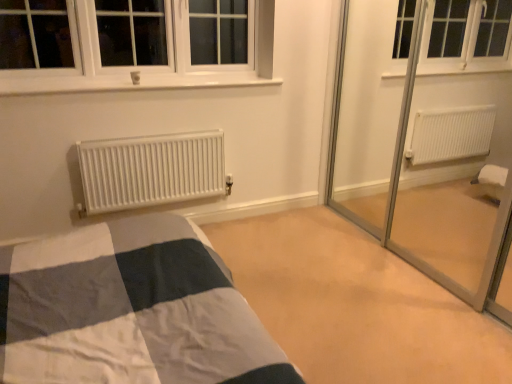
Locate an element on the screen. The image size is (512, 384). beige carpet at center is located at coordinates (356, 304).

Consider the image. Measure the distance between point [328,369] and camera.

They are 5.88 feet apart.

What do you see at coordinates (356, 304) in the screenshot? I see `beige carpet at center` at bounding box center [356, 304].

Find the location of a particular element. white matte radiator at center is located at coordinates pos(151,171).

This screenshot has height=384, width=512. What do you see at coordinates (151, 171) in the screenshot?
I see `white matte radiator at center` at bounding box center [151, 171].

Identify the location of beige carpet at center. The image size is (512, 384). (356, 304).

Is white matte radiator at center to the left of beige carpet at center from the viewer's perspective?

Yes.

Is white matte radiator at center behind beige carpet at center?

That is True.

Does point (153, 181) lie in front of point (280, 254)?

No.

From the image's perspective, which one is positioned higher, white matte radiator at center or beige carpet at center?

white matte radiator at center is shown above in the image.

From a real-world perspective, which object rests below the other?

beige carpet at center, from a real-world perspective.

Considering the relative sizes of white matte radiator at center and beige carpet at center in the image provided, is white matte radiator at center wider than beige carpet at center?

No.

From the picture: Considering the sizes of objects white matte radiator at center and beige carpet at center in the image provided, who is taller, white matte radiator at center or beige carpet at center?

white matte radiator at center is taller.

Is white matte radiator at center bigger or smaller than beige carpet at center?

Considering their sizes, white matte radiator at center takes up less space than beige carpet at center.

Is beige carpet at center inside white matte radiator at center?

No.

Is white matte radiator at center positioned far away from beige carpet at center?

No, white matte radiator at center is not far from beige carpet at center.

Is white matte radiator at center oriented away from beige carpet at center?

white matte radiator at center is not turned away from beige carpet at center.

You are a GUI agent. You are given a task and a screenshot of the screen. Output one action in this format:
    pyautogui.click(x=<x>, y=<y>)
    Task: Click on the plain in front of the white matte radiator at center
    
    Given the screenshot: What is the action you would take?
    pyautogui.click(x=356, y=304)

Considering the relative positions of beige carpet at center and white matte radiator at center in the image provided, is beige carpet at center to the left of white matte radiator at center from the viewer's perspective?

Incorrect, beige carpet at center is not on the left side of white matte radiator at center.

Which is in front, beige carpet at center or white matte radiator at center?

beige carpet at center is closer to the camera.

Considering the points (340, 287) and (131, 199), which point is in front, point (340, 287) or point (131, 199)?

The point (340, 287) is closer.

From the image's perspective, is beige carpet at center positioned above or below white matte radiator at center?

From the image's perspective, beige carpet at center appears below white matte radiator at center.

From a real-world perspective, which is physically above, beige carpet at center or white matte radiator at center?

white matte radiator at center, from a real-world perspective.

Can you confirm if beige carpet at center is thinner than white matte radiator at center?

No.

Considering the sizes of objects beige carpet at center and white matte radiator at center in the image provided, who is taller, beige carpet at center or white matte radiator at center?

With more height is white matte radiator at center.

Considering the relative sizes of beige carpet at center and white matte radiator at center in the image provided, is beige carpet at center smaller than white matte radiator at center?

Incorrect, beige carpet at center is not smaller in size than white matte radiator at center.

Is beige carpet at center spatially inside white matte radiator at center, or outside of it?

beige carpet at center lies outside white matte radiator at center.

Are beige carpet at center and white matte radiator at center far apart?

No.

Could you tell me if beige carpet at center is turned towards white matte radiator at center?

No, beige carpet at center is not oriented towards white matte radiator at center.

What's the angular difference between beige carpet at center and white matte radiator at center's facing directions?

The facing directions of beige carpet at center and white matte radiator at center are 180 degrees apart.

You are a GUI agent. You are given a task and a screenshot of the screen. Output one action in this format:
    pyautogui.click(x=<x>, y=<y>)
    Task: Click on the heater above the beige carpet at center (from a real-world perspective)
    The image size is (512, 384).
    Given the screenshot: What is the action you would take?
    pyautogui.click(x=151, y=171)

Find the location of `plain below the white matte radiator at center (from a real-world perspective)`. plain below the white matte radiator at center (from a real-world perspective) is located at coordinates (356, 304).

The height and width of the screenshot is (384, 512). Identify the location of plain lying on the right of white matte radiator at center. (356, 304).